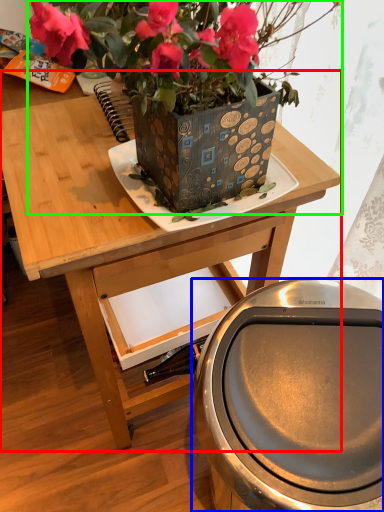
Question: Considering the real-world distances, which object is closest to table (highlighted by a red box)? potty (highlighted by a blue box) or houseplant (highlighted by a green box).

Choices:
 (A) potty
 (B) houseplant

Answer: (B)